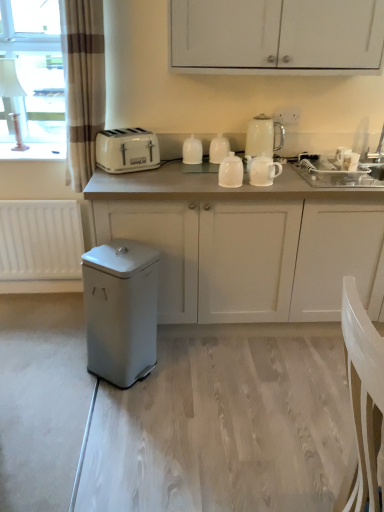
Question: Considering the positions of point (268, 177) and point (127, 164), is point (268, 177) closer or farther from the camera than point (127, 164)?

Choices:
 (A) closer
 (B) farther

Answer: (A)

Question: Is white glossy teapot at center, the 4th kitchen appliance in the left-to-right sequence, inside or outside of white plastic toaster at upper center?

Choices:
 (A) inside
 (B) outside

Answer: (B)

Question: Estimate the real-world distances between objects in this image. Which object is farther from the white matte cabinet at center, which is the first cabinetry from bottom to top?

Choices:
 (A) white matte cabinet at upper center, the first cabinetry positioned from the top
 (B) white plastic toaster at upper center
 (C) white matte trash can at lower left
 (D) matte gray trash can at lower left
 (E) white glossy teapot at center, the 4th kitchen appliance in the left-to-right sequence

Answer: (A)

Question: Based on their relative distances, which object is farther from the white matte cabinet at center, positioned as the 2th cabinetry in top-to-bottom order?

Choices:
 (A) white glossy teapot at center, the 4th kitchen appliance in the left-to-right sequence
 (B) brown striped curtain at left
 (C) white glossy teapot at center, the third kitchen appliance in the right-to-left sequence
 (D) white glossy mugs at upper center, the fourth kitchen appliance from the right
 (E) white plastic toaster at upper center

Answer: (B)